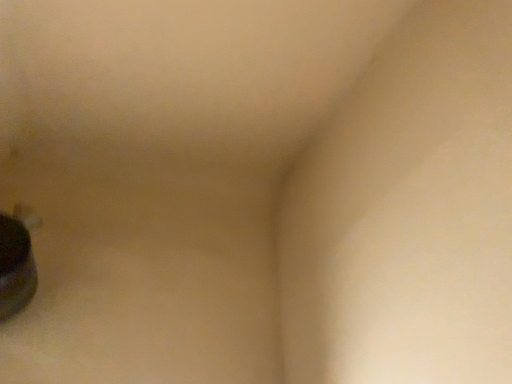
Find the location of `shiny green vase at lower left`. shiny green vase at lower left is located at coordinates (17, 261).

The width and height of the screenshot is (512, 384). Describe the element at coordinates (17, 261) in the screenshot. I see `shiny green vase at lower left` at that location.

You are a GUI agent. You are given a task and a screenshot of the screen. Output one action in this format:
    pyautogui.click(x=<x>, y=<y>)
    Task: Click on the shiny green vase at lower left
    Image resolution: width=512 pixels, height=384 pixels.
    Given the screenshot: What is the action you would take?
    (x=17, y=261)